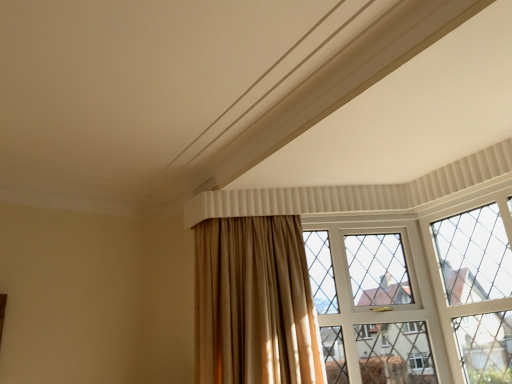
Question: From the image's perspective, is satin gold curtain at center above or below clear glass window at center?

Choices:
 (A) above
 (B) below

Answer: (A)

Question: Is satin gold curtain at center bigger or smaller than clear glass window at center?

Choices:
 (A) big
 (B) small

Answer: (A)

Question: Is point (261, 352) positioned closer to the camera than point (380, 263)?

Choices:
 (A) farther
 (B) closer

Answer: (B)

Question: In terms of width, does clear glass window at center look wider or thinner when compared to satin gold curtain at center?

Choices:
 (A) thin
 (B) wide

Answer: (A)

Question: Looking at the image, does clear glass window at center seem bigger or smaller compared to satin gold curtain at center?

Choices:
 (A) small
 (B) big

Answer: (A)

Question: Would you say clear glass window at center is to the left or to the right of satin gold curtain at center in the picture?

Choices:
 (A) right
 (B) left

Answer: (A)

Question: From the image's perspective, is clear glass window at center positioned above or below satin gold curtain at center?

Choices:
 (A) above
 (B) below

Answer: (B)